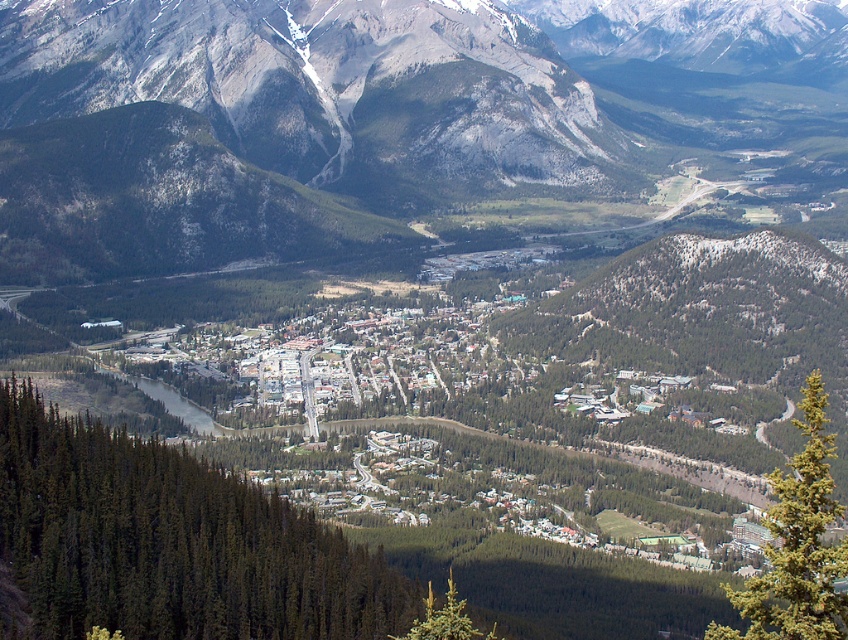
This screenshot has width=848, height=640. What do you see at coordinates (422, 100) in the screenshot? I see `gray rocky mountain range at center` at bounding box center [422, 100].

Is gray rocky mountain range at center thinner than green textured pine tree at lower center?

No.

Does point (593, 65) lie in front of point (466, 616)?

No, it is behind (466, 616).

Image resolution: width=848 pixels, height=640 pixels. I want to click on gray rocky mountain range at center, so click(x=422, y=100).

Which of these two, green matte tree at center or green textured pine tree at lower center, stands shorter?

green textured pine tree at lower center is shorter.

Who is taller, green matte tree at center or green textured pine tree at lower center?

green matte tree at center

Is point (210, 600) farther from viewer compared to point (436, 611)?

That is True.

In order to click on green matte tree at center in this screenshot , I will do `click(169, 544)`.

Consider the image. Can you confirm if gray rocky mountain range at center is positioned above green matte tree at center?

Correct, gray rocky mountain range at center is located above green matte tree at center.

Is gray rocky mountain range at center positioned behind green matte tree at center?

Yes, gray rocky mountain range at center is behind green matte tree at center.

Between point (530, 104) and point (102, 550), which one is positioned behind?

Positioned behind is point (530, 104).

Where is `gray rocky mountain range at center`? gray rocky mountain range at center is located at coordinates (422, 100).